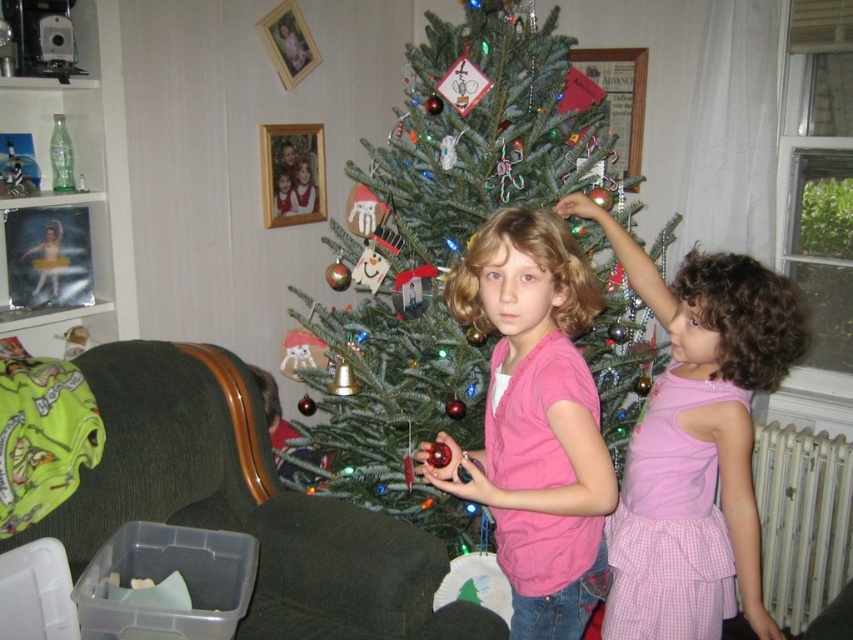
You are standing in front of the Christmas tree and want to place a decoration. There are two points marked on the tree where you can hang it. The first point is at coordinates point [508,260] and the second is at point [730,292]. Which point is closer to you?

Point [508,260] is closer to the viewer than point [730,292], so you should choose that point to hang the decoration.

You are planning to place a new throw blanket on either the dark green fabric armchair at lower left or the pink cotton dress at center. Which object can accommodate a larger throw blanket based on their sizes?

The dark green fabric armchair at lower left has a larger width than the pink cotton dress at center, so it can accommodate a larger throw blanket.